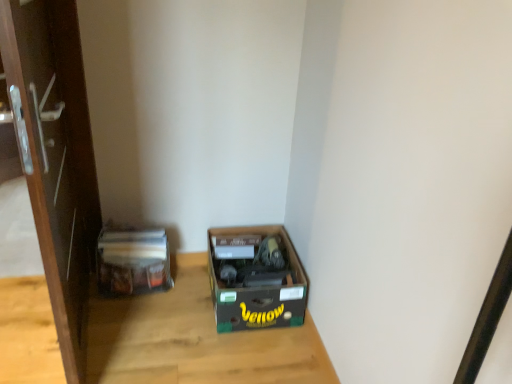
Locate an element on the screen. vacant space that is in between brown glossy door at left and brown cardboard box at lower center is located at coordinates (170, 332).